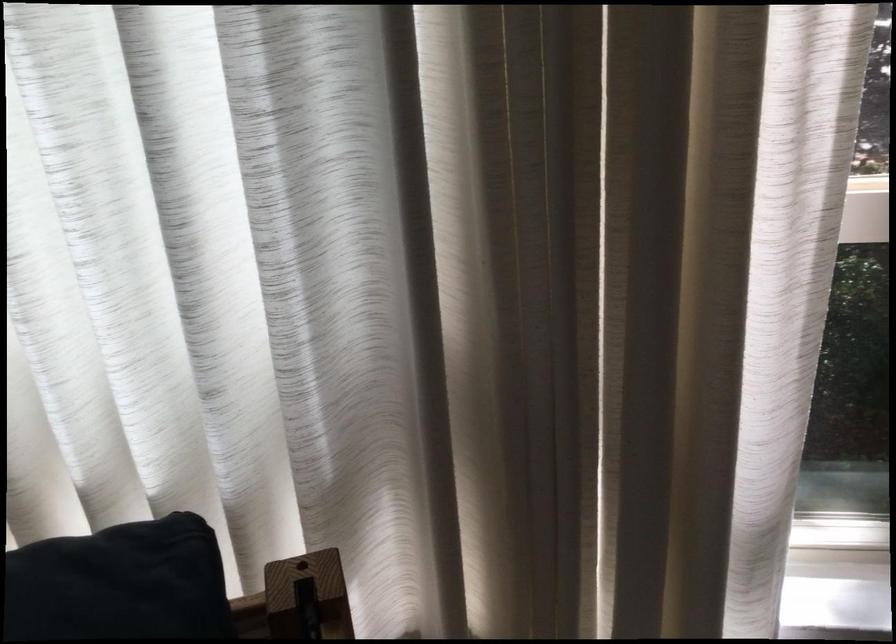
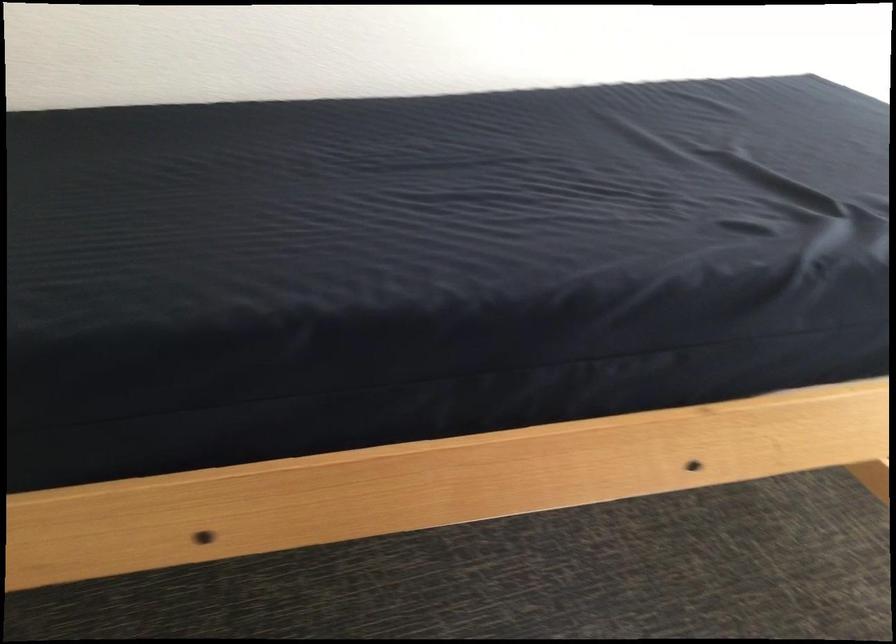
The first image is from the beginning of the video and the second image is from the end. How did the camera likely rotate when shooting the video?

The rotation direction of the camera is left-down.